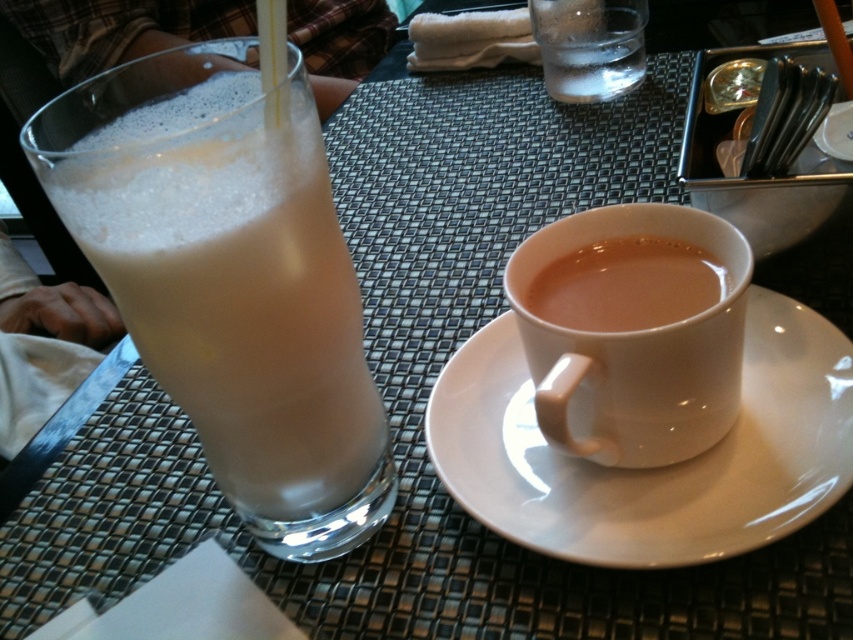
Question: Can you confirm if white ceramic mug at center is positioned above brown matte cup at center?

Choices:
 (A) no
 (B) yes

Answer: (A)

Question: Does brown matte cup at center have a greater width compared to clear glass at upper center?

Choices:
 (A) no
 (B) yes

Answer: (A)

Question: Which object appears farthest from the camera in this image?

Choices:
 (A) milky white glass at left
 (B) brown matte cup at center
 (C) white ceramic mug at center

Answer: (B)

Question: Which of the following is the farthest from the observer?

Choices:
 (A) milky white glass at left
 (B) white ceramic saucer at center
 (C) brown matte cup at center
 (D) clear glass at upper center

Answer: (D)

Question: Which object is closer to the camera taking this photo?

Choices:
 (A) brown matte cup at center
 (B) white ceramic mug at center
 (C) milky white glass at left
 (D) white ceramic saucer at center

Answer: (C)

Question: Is white ceramic saucer at center to the right of white ceramic mug at center from the viewer's perspective?

Choices:
 (A) yes
 (B) no

Answer: (A)